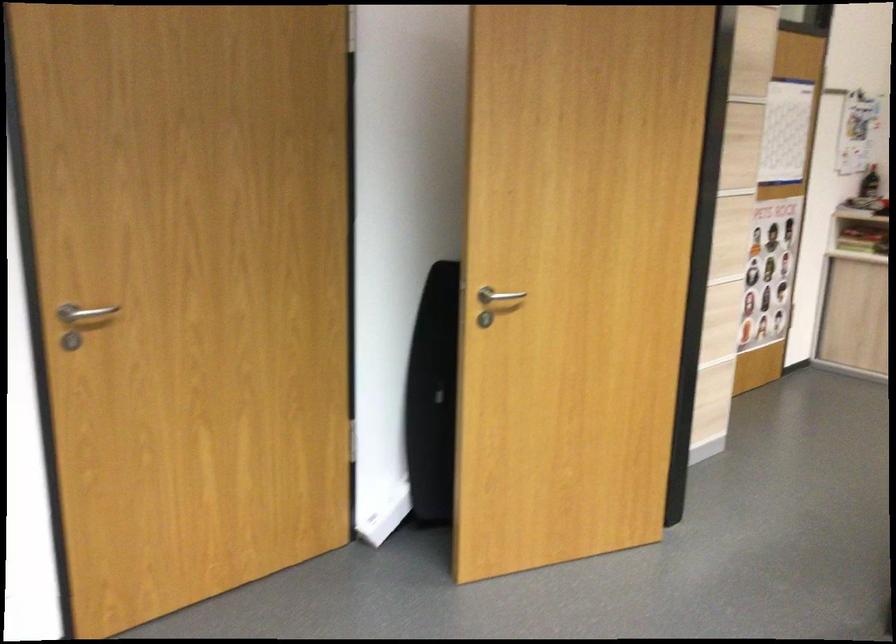
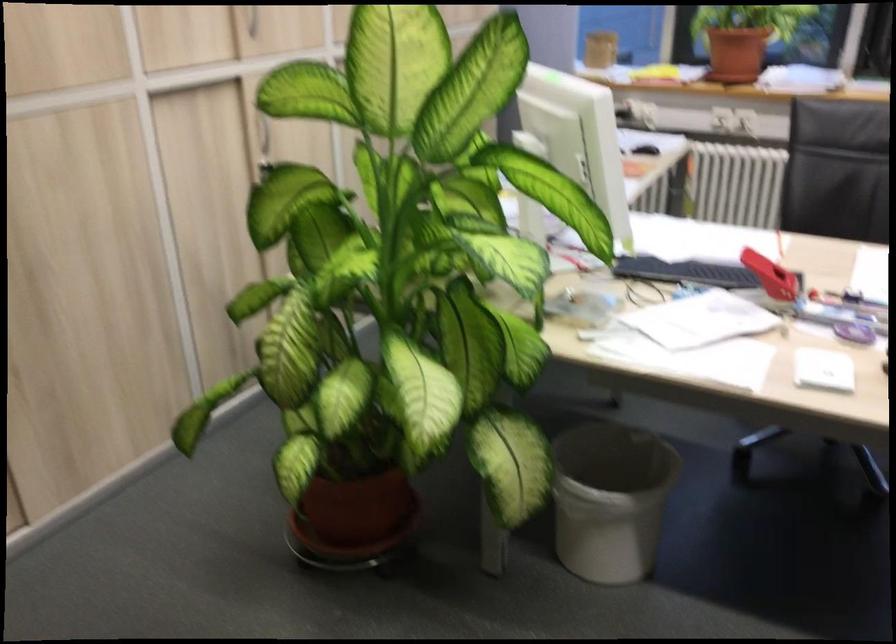
The images are taken continuously from a first-person perspective. In which direction is your viewpoint rotating?

The camera rotated toward right-down.